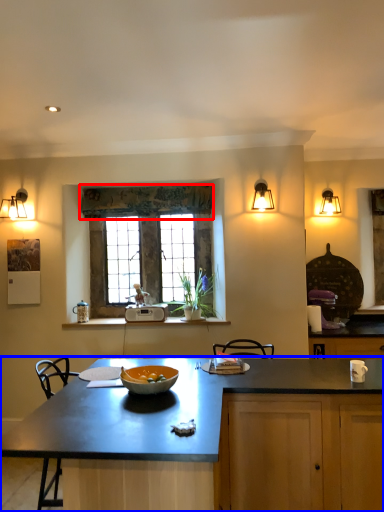
Question: Which point is further to the camera, curtain (highlighted by a red box) or countertop (highlighted by a blue box)?

Choices:
 (A) curtain
 (B) countertop

Answer: (A)